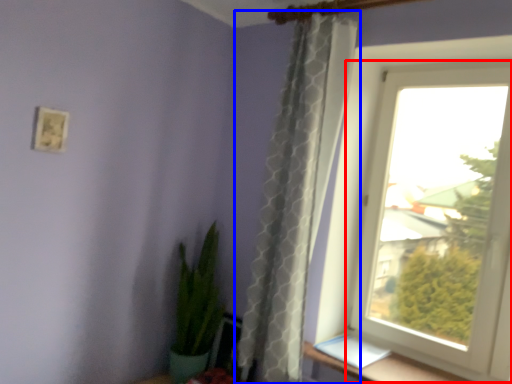
Question: Which object appears closest to the camera in this image, window (highlighted by a red box) or curtain (highlighted by a blue box)?

Choices:
 (A) window
 (B) curtain

Answer: (B)